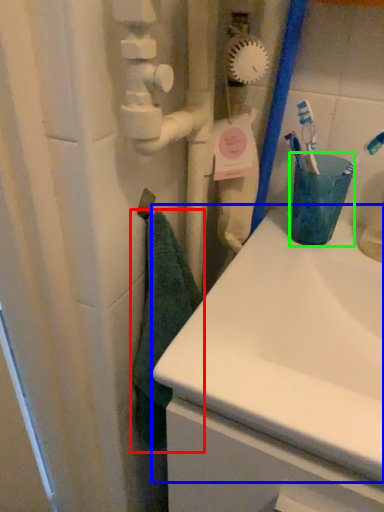
Question: Based on their relative distances, which object is farther from bath towel (highlighted by a red box)? Choose from sink (highlighted by a blue box) and turquoise (highlighted by a green box).

Choices:
 (A) sink
 (B) turquoise

Answer: (B)